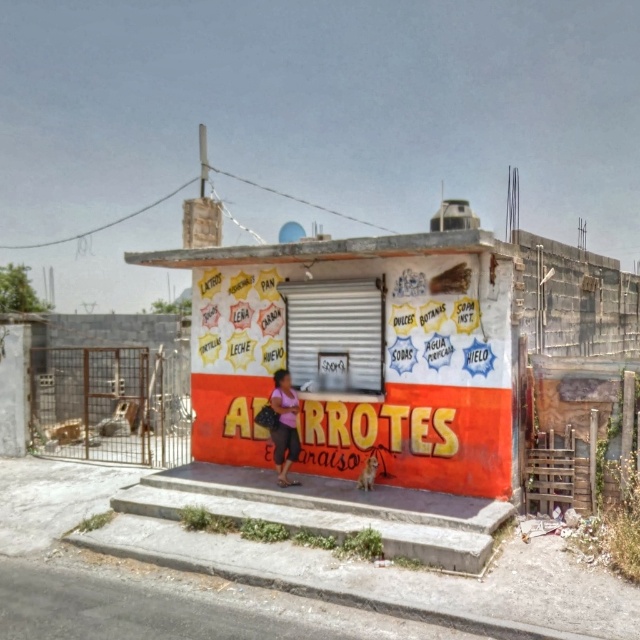
Does orange painted wall at center lie in front of pink fabric dress at center?

Yes, orange painted wall at center is closer to the viewer.

Is point (209, 340) farther from viewer compared to point (298, 403)?

That is True.

Locate an element on the screen. Image resolution: width=640 pixels, height=640 pixels. orange painted wall at center is located at coordinates (358, 353).